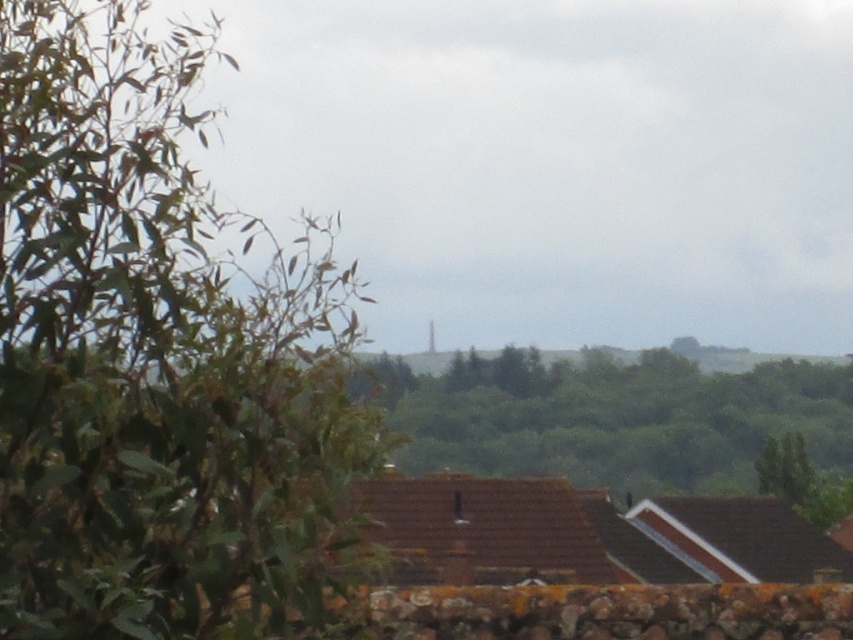
Question: Which point is closer to the camera taking this photo?

Choices:
 (A) (257, 408)
 (B) (799, 492)

Answer: (A)

Question: Which point is farther to the camera?

Choices:
 (A) (756, 476)
 (B) (204, 113)

Answer: (A)

Question: Is green leafy tree at center positioned before green leafy tree at lower right?

Choices:
 (A) yes
 (B) no

Answer: (A)

Question: Does green leafy tree at center have a smaller size compared to green leafy tree at lower right?

Choices:
 (A) yes
 (B) no

Answer: (B)

Question: Which point appears closest to the camera in this image?

Choices:
 (A) (747, 412)
 (B) (170, 320)
 (C) (779, 442)

Answer: (B)

Question: Can you confirm if green leafy tree at left is bigger than green leafy tree at lower right?

Choices:
 (A) no
 (B) yes

Answer: (B)